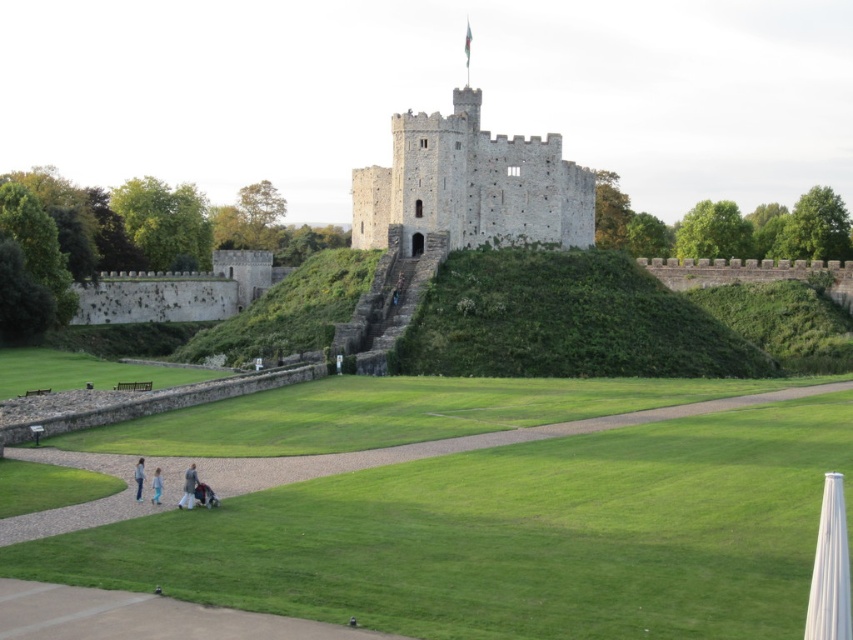
Consider the image. Can you confirm if stone tower at center is thinner than light blue jeans at lower left?

In fact, stone tower at center might be wider than light blue jeans at lower left.

Looking at this image, is stone tower at center taller than light blue jeans at lower left?

Indeed, stone tower at center has a greater height compared to light blue jeans at lower left.

Find the location of a particular element. Image resolution: width=853 pixels, height=640 pixels. stone tower at center is located at coordinates (469, 186).

Between point (196, 476) and point (158, 481), which one is positioned behind?

The point (196, 476) is behind.

Which is in front, point (193, 464) or point (157, 476)?

Point (157, 476)

Is point (194, 481) closer to camera compared to point (154, 497)?

Yes, point (194, 481) is closer to viewer.

Where is `light brown fabric jacket at lower center`? This screenshot has width=853, height=640. light brown fabric jacket at lower center is located at coordinates (189, 486).

Does green grass at center appear over light brown fabric jacket at lower center?

Incorrect, green grass at center is not positioned above light brown fabric jacket at lower center.

Who is lower down, green grass at center or light brown fabric jacket at lower center?

Positioned lower is green grass at center.

Identify the location of green grass at center. This screenshot has height=640, width=853. (467, 547).